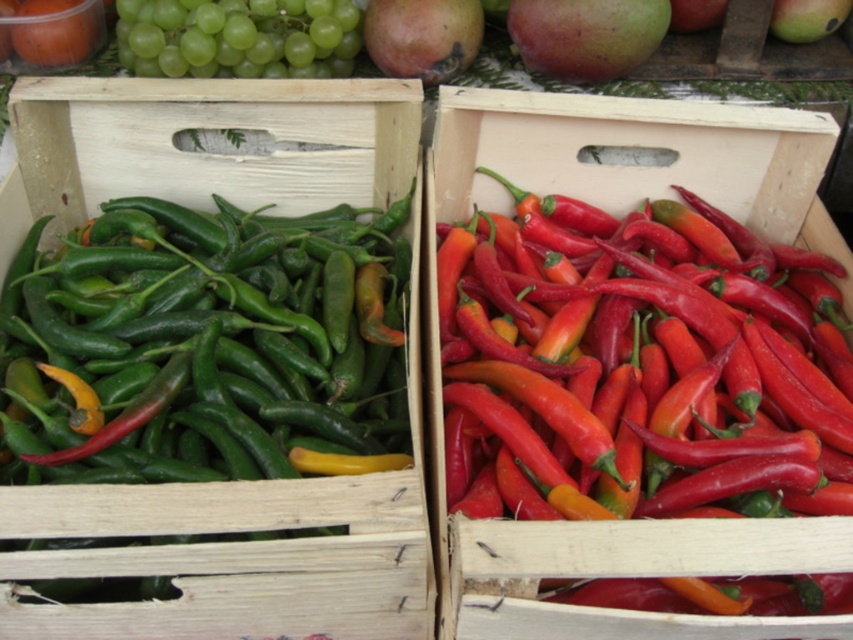
You are organizing a fruit display and need to place the matte wood box at center and the green matte mango at upper right. Which object should you place first if you want to ensure there is enough space for both?

The matte wood box at center is bigger than the green matte mango at upper right, so you should place the matte wood box at center first to ensure there is enough space for both.

You are an inventory manager checking the crates and notice a point marked on the image. What fruit is located at the coordinates point (422, 36)?

The point (422, 36) indicates a matte green mango at upper center.

Based on the photo, you are arranging fruits in a display and need to place a new fruit between the matte green mango at upper center and the green matte mango at upper right. Based on their positions, which mango should be on the left side of the new fruit?

The matte green mango at upper center is to the left of the green matte mango at upper right, so the new fruit should be placed between them with the matte green mango at upper center on the left side and the green matte mango at upper right on the right side.